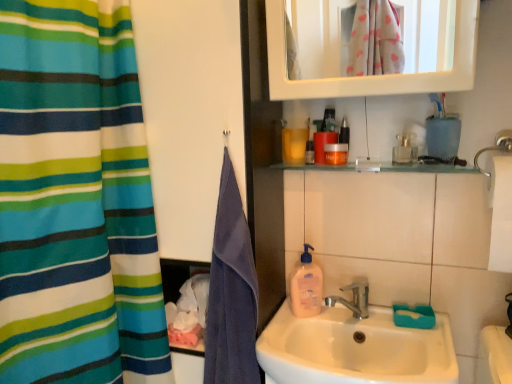
At what (x,y) coordinates should I click in order to perform the action: click on vacant space in front of translucent plastic soap dispenser at sink. Please return your answer as a coordinate pair (x, y). Looking at the image, I should click on (290, 333).